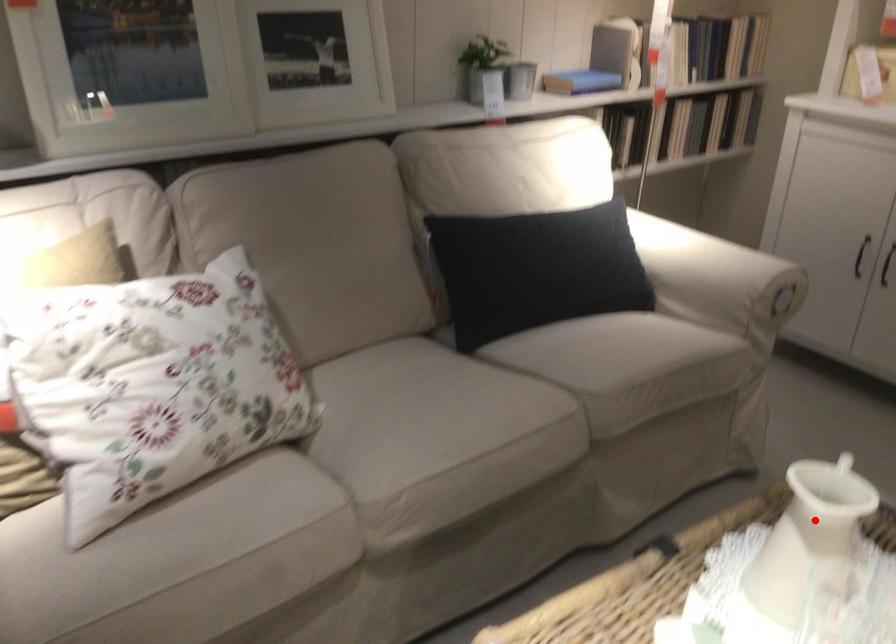
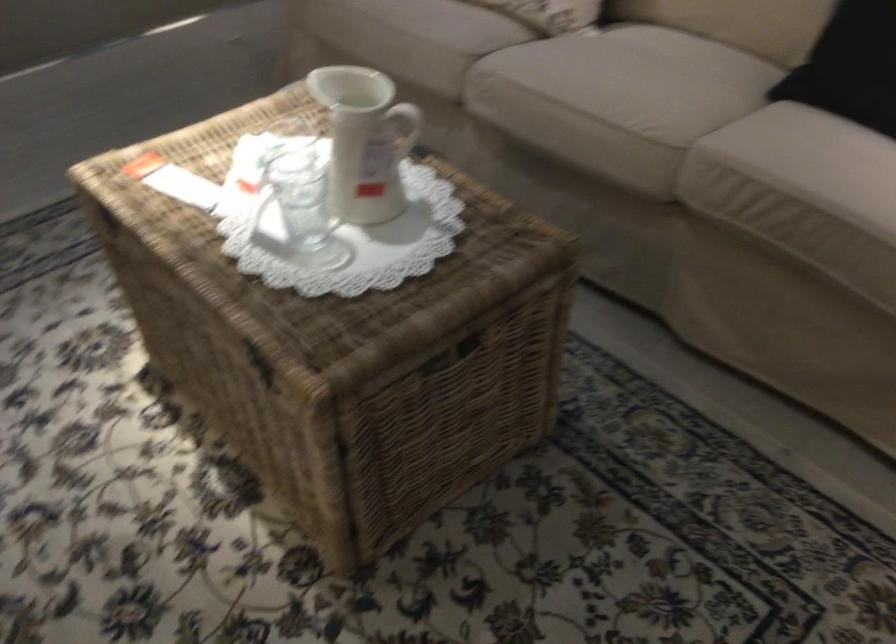
Question: I am providing you with two images of the same scene from different viewpoints. In image1, a red point is highlighted. Considering the same 3D point in image2, which of the following is correct?

Choices:
 (A) It is closer
 (B) It is farther

Answer: (B)